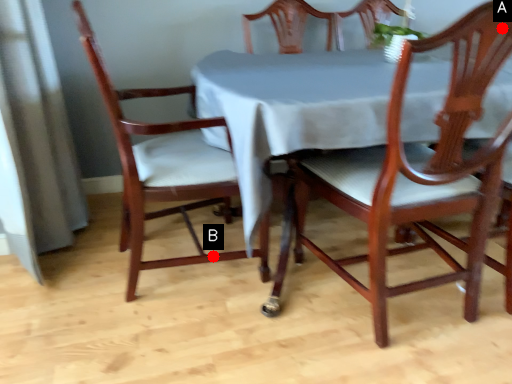
Question: Two points are circled on the image, labeled by A and B beside each circle. Which point appears farthest from the camera in this image?

Choices:
 (A) A is further
 (B) B is further

Answer: (B)